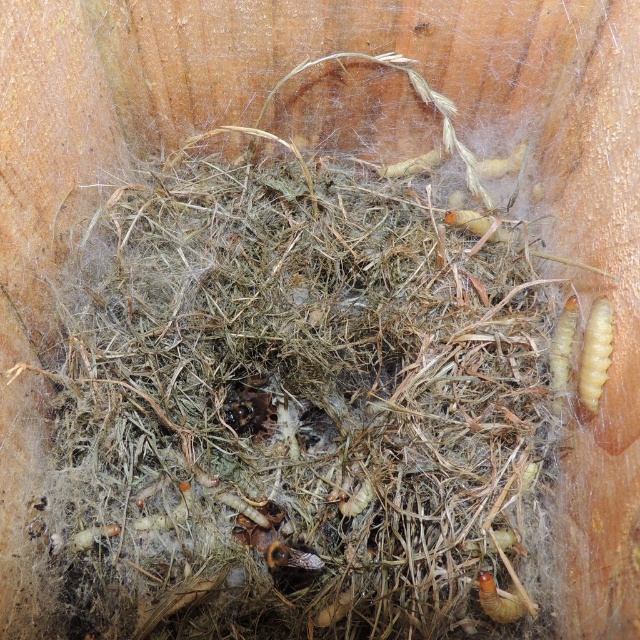
You are examining the nest in the wooden container and want to place a small object at point (x=568, y=342) and another at point (x=477, y=577). Which point is closer to you?

Point (x=477, y=577) is closer to you because it is less further to the camera than point (x=568, y=342).

You are a researcher holding a ruler that is 1 meter long. You want to measure the distance between you and the yellowish matte caterpillar at right. Can your ruler reach that distance?

The distance between you and the yellowish matte caterpillar at right is 1.22 meters, which is longer than the ruler you have. Therefore, your ruler cannot reach the distance.

You are holding a small flashlight and want to illuminate the point at coordinates point (584, 337) in the nest. Given that the flashlight has a maximum range of 4 feet, will it reach that point?

The point (584, 337) is 3.94 feet away from the viewer, so yes, the flashlight can reach it since its range is within the maximum 4 feet.